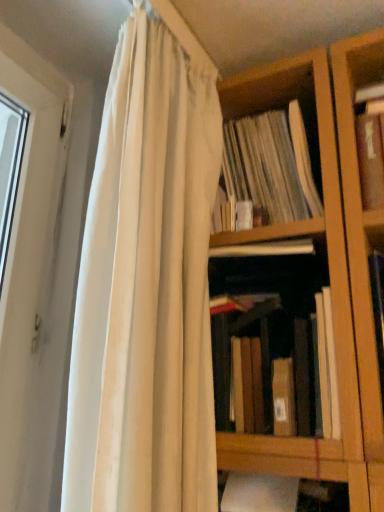
The image size is (384, 512). I want to click on free point above white cotton curtain at upper left (from a real-world perspective), so click(x=202, y=18).